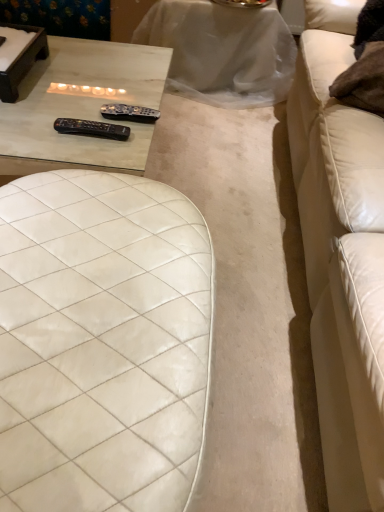
Image resolution: width=384 pixels, height=512 pixels. I want to click on free spot in front of black plastic remote at center, which appears as the 2th remote when viewed from the back, so click(x=82, y=155).